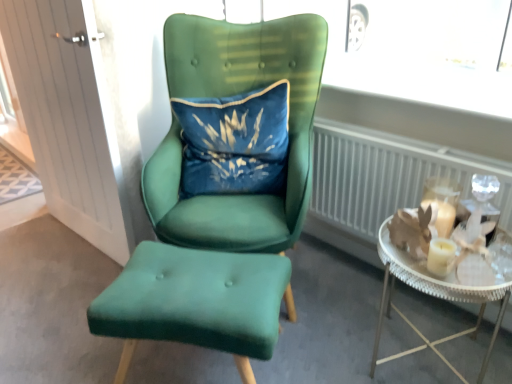
Locate an element on the screen. The width and height of the screenshot is (512, 384). free space above metallic silver tray at right (from a real-world perspective) is located at coordinates (454, 248).